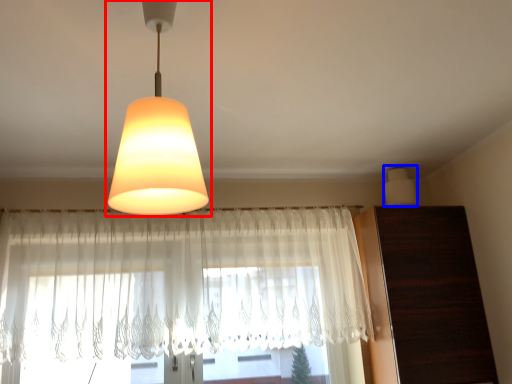
Question: Among these objects, which one is nearest to the camera, lamp (highlighted by a red box) or lamp (highlighted by a blue box)?

Choices:
 (A) lamp
 (B) lamp

Answer: (A)